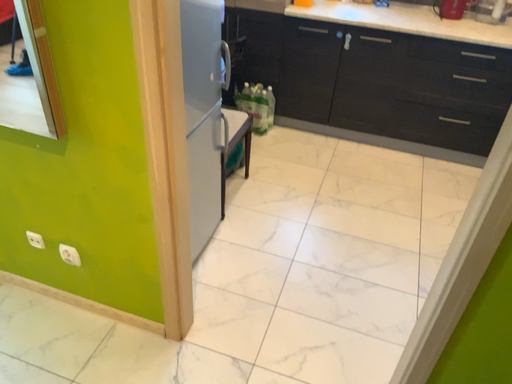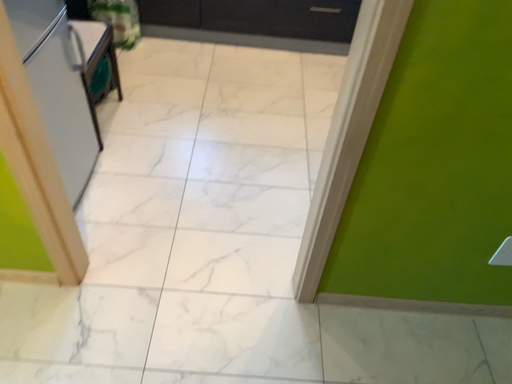
Question: How did the camera likely rotate when shooting the video?

Choices:
 (A) rotated downward
 (B) rotated upward

Answer: (A)